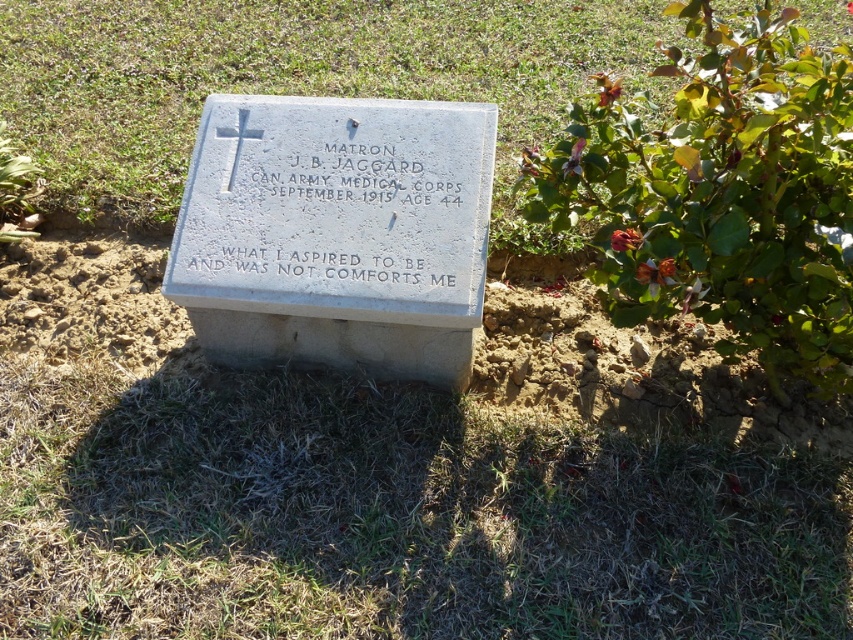
You are a gardener who wants to plant a new flower bed between the green grass at center and the bright red petals at upper right. The flower bed requires a space of 10 feet between the two points. Based on the scene, will there be enough space for the flower bed?

The distance between the green grass at center and the bright red petals at upper right is 8.11 feet, which is less than the required 10 feet for the flower bed. Therefore, there isn not enough space.

You are standing at the entrance of the cemetery and see the gravestone with the cross symbol at the top left corner. Where is the green grass at lower center in relation to your position?

The green grass at lower center is located at point [392,516], which is to the lower center area from your position at the cemetery entrance.

You are standing in a cemetery and see the gravestone with green grass at center and bright red petals at upper right. Which object is bigger in size?

The green grass at center is larger in size compared to the bright red petals at upper right.